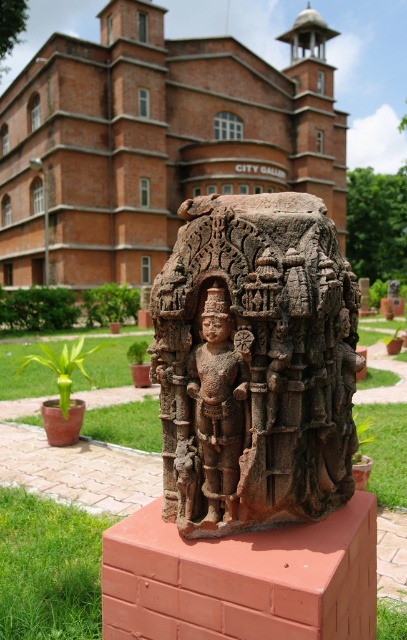
Question: Which object appears farthest from the camera in this image?

Choices:
 (A) brown stone statue at center
 (B) brown stone deity at center

Answer: (B)

Question: Does brown stone statue at center come in front of brown stone deity at center?

Choices:
 (A) yes
 (B) no

Answer: (A)

Question: Which of the following is the farthest from the observer?

Choices:
 (A) (203, 452)
 (B) (312, 477)

Answer: (A)

Question: Is brown stone statue at center smaller than brown stone deity at center?

Choices:
 (A) no
 (B) yes

Answer: (A)

Question: Is brown stone statue at center wider than brown stone deity at center?

Choices:
 (A) yes
 (B) no

Answer: (A)

Question: Which point is closer to the camera?

Choices:
 (A) brown stone deity at center
 (B) brown stone statue at center

Answer: (B)